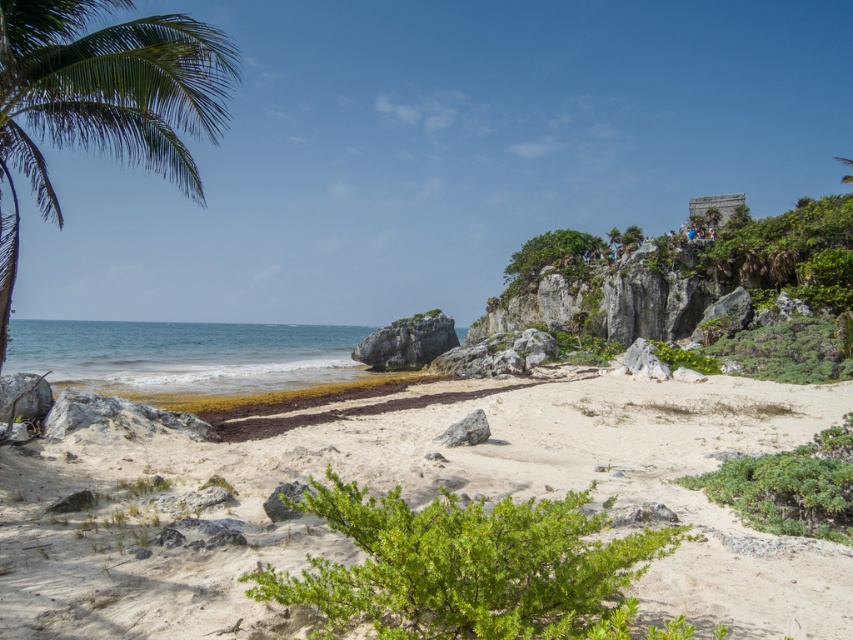
You are standing at the camera position and want to reach the point marked at coordinates (x=479, y=422). How far will you have to walk to get there?

The point marked at coordinates (x=479, y=422) is 12.55 meters away from the camera, so you will have to walk 12.55 meters to reach it.

You are standing at the beach and want to walk from the point at coordinates point (137,90) to the point at coordinates point (287,506). Which direction should you face to walk towards the second point?

You should face towards the front because point (137,90) is behind point (287,506), meaning the second point is in front of you when you are at the first point.

You are standing on the beach in the image and want to reach the point marked at coordinates (550, 429). If you can walk 10 feet per minute, how many minutes will it take you to reach that point?

You are 49.28 feet away from the point marked at coordinates (550, 429). At a walking speed of 10 feet per minute, it will take approximately 4.93 minutes to reach the point.